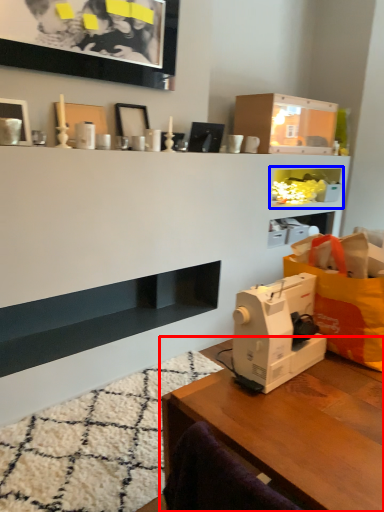
Question: Which of the following is the farthest to the observer, table (highlighted by a red box) or cabinet (highlighted by a blue box)?

Choices:
 (A) table
 (B) cabinet

Answer: (B)